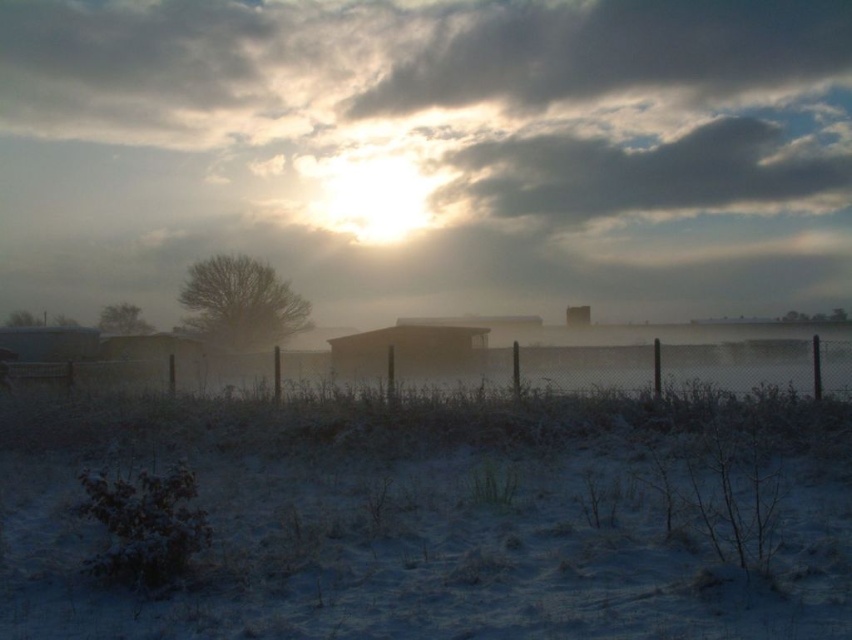
You are an artist trying to capture this winter scene. You want to paint the frosted glass morning fog at center and the dark gray cloud at upper center. Which object should you paint first to maintain depth perception in your painting?

You should paint the frosted glass morning fog at center first because it is closer to the viewer than the dark gray cloud at upper center, so painting it first will help establish depth by placing it in front of the cloud.

You are standing in a winter landscape with a chain link fence in the middle. You see a point marked at coordinate (654, 172). Based on the scene, what does this point most likely represent?

The point at coordinate (654, 172) most likely represents cloudy at upper center.

You are standing in the winter landscape and want to reach a specific point marked as point (542, 156). If your maximum walking distance is 50 meters, can you reach it without exceeding your limit?

The point (542, 156) is 61.17 meters away from the viewer, which exceeds your maximum walking distance of 50 meters. Therefore, you cannot reach it without exceeding your limit.